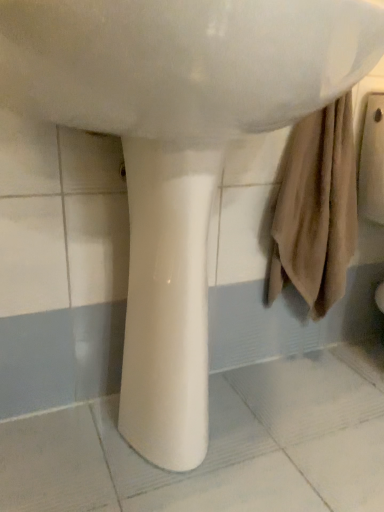
At what (x,y) coordinates should I click in order to perform the action: click on vacant space to the right of white glossy pedestal at center. Please return your answer as a coordinate pair (x, y). Image resolution: width=384 pixels, height=512 pixels. Looking at the image, I should click on (263, 438).